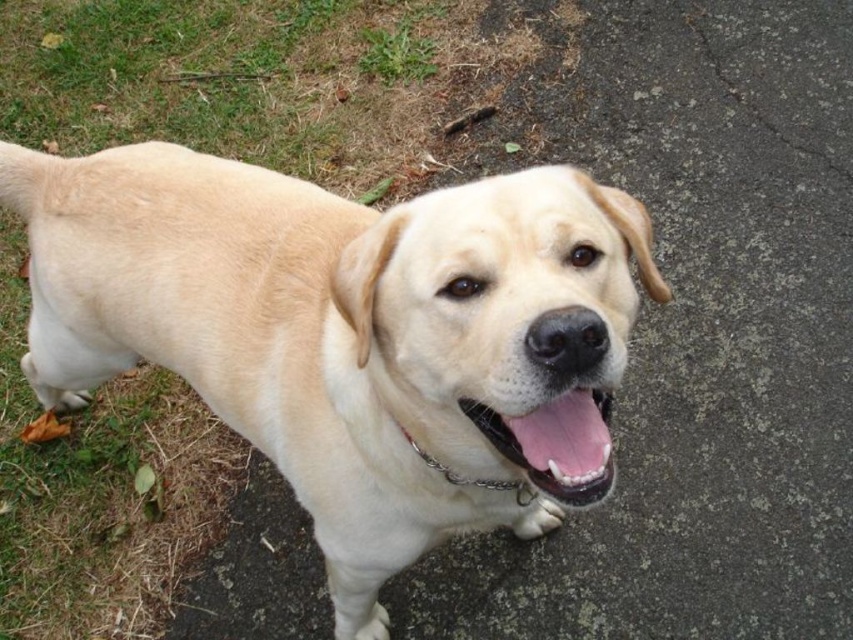
You are a photographer trying to capture the light beige fur dog at center and the pink glossy tongue at center in a single shot. Which object should you focus on first to ensure both are in focus?

You should focus on the light beige fur dog at center first because it is closer to the viewer than the pink glossy tongue at center, so focusing on the closer object will help both be in focus.

You are a photographer trying to capture the light beige fur dog at center and the pink glossy tongue at center in a single frame. Which object should you focus on first if you want to ensure both are in focus?

The light beige fur dog at center should be focused on first because it is positioned on the left side of the pink glossy tongue at center, so focusing on the closer object first would help ensure both are in focus.

You are a dog trainer observing the light beige fur dog at center and the metal chain at center. Which object is wider?

The light beige fur dog at center is wider than the metal chain at center.